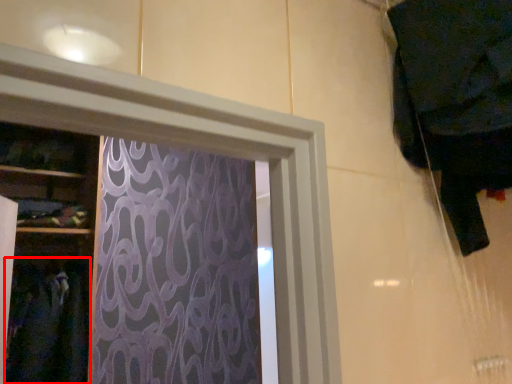
Question: Observing the image, what is the correct spatial positioning of clothing (annotated by the red box) in reference to clothing?

Choices:
 (A) left
 (B) right

Answer: (A)